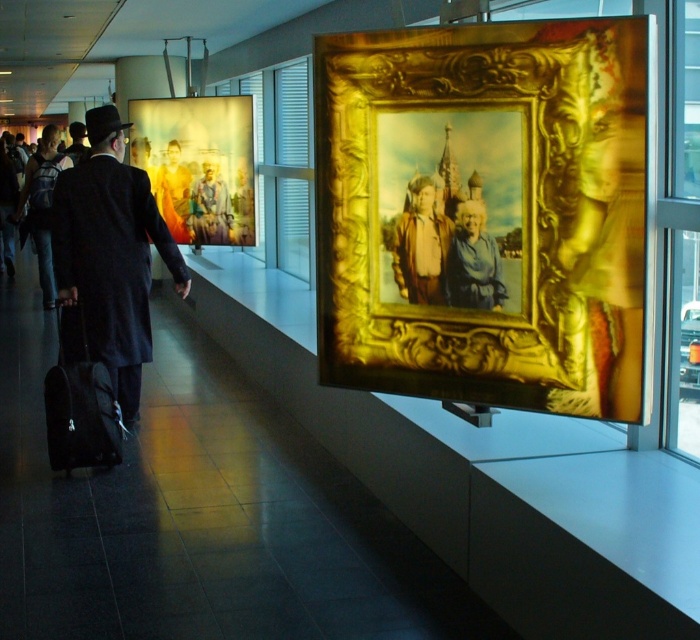
You are an art curator standing at the entrance of the gallery. You need to hang a new painting that requires a hook at position point 0.334 on the horizontal axis. Is the gold ornate frame at upper center currently occupying this position?

The gold ornate frame at upper center is positioned at point 0.334 on the horizontal axis, so yes, it is occupying that position.

You are standing in the art gallery and notice two points marked on the wall. The first point is at coordinate point (x=206, y=228) and the second is at point (x=105, y=433). Which point is closer to your eyes?

Point (x=206, y=228) is further to the camera than point (x=105, y=433), so the second point is closer to your eyes.

You are a security guard in the gallery and want to move from the black fabric suitcase at lower left to the black wool coat at center. Can you walk directly between them without needing to step around any obstacles?

The distance between the black wool coat at center and the black fabric suitcase at lower left is 19.80 inches, which is too narrow for a person to walk through. You will need to step around the objects.